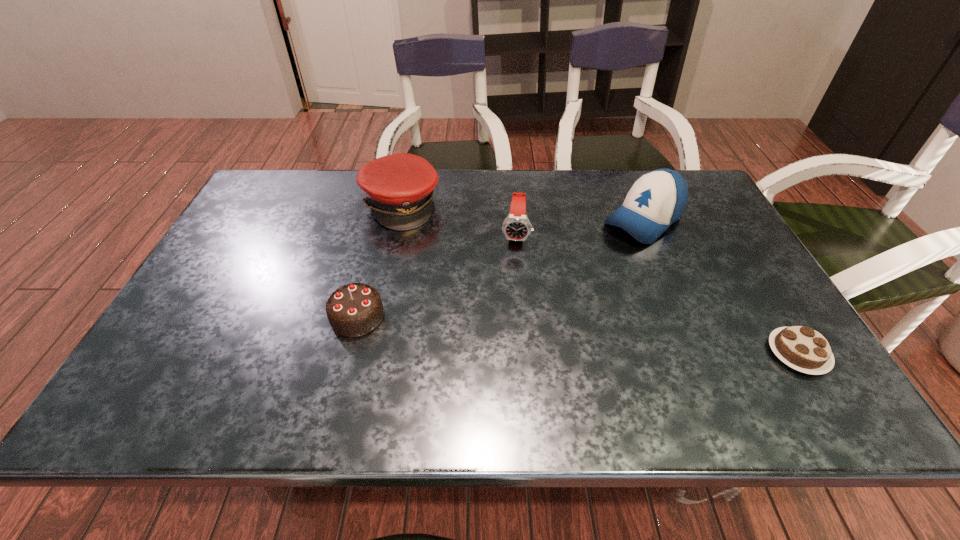
Identify the location of the taller chocolate cake. (353, 310).

The width and height of the screenshot is (960, 540). In order to click on the left chocolate cake in this screenshot , I will do `click(353, 310)`.

The image size is (960, 540). What are the coordinates of `the shorter chocolate cake` in the screenshot? It's located at (801, 348).

Image resolution: width=960 pixels, height=540 pixels. What are the coordinates of `the shortest object` in the screenshot? It's located at (801, 348).

This screenshot has width=960, height=540. I want to click on the third object from left to right, so click(x=516, y=227).

Find the location of `cap`. cap is located at coordinates (399, 188).

In order to click on the second object from right to left in this screenshot , I will do `click(657, 199)`.

Where is `free space located 0.100m on the front of the fourth tallest object`? The image size is (960, 540). free space located 0.100m on the front of the fourth tallest object is located at coordinates (342, 376).

You are a GUI agent. You are given a task and a screenshot of the screen. Output one action in this format:
    pyautogui.click(x=<x>, y=<y>)
    Task: Click on the vacant space located on the left of the rightmost object
    Image resolution: width=960 pixels, height=540 pixels.
    Given the screenshot: What is the action you would take?
    pyautogui.click(x=729, y=353)

Identify the location of vacant point located on the face of the watch. (508, 348).